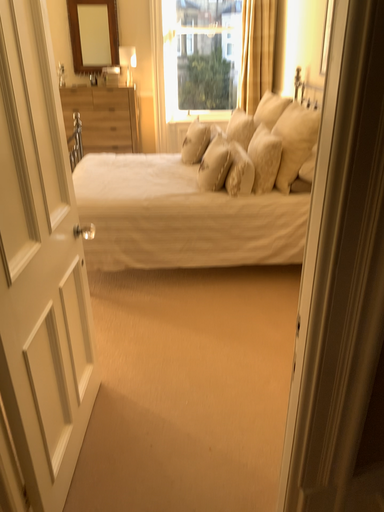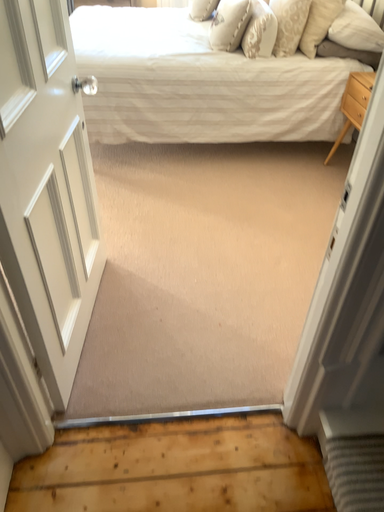
Question: Which way did the camera rotate in the video?

Choices:
 (A) rotated upward
 (B) rotated downward

Answer: (B)